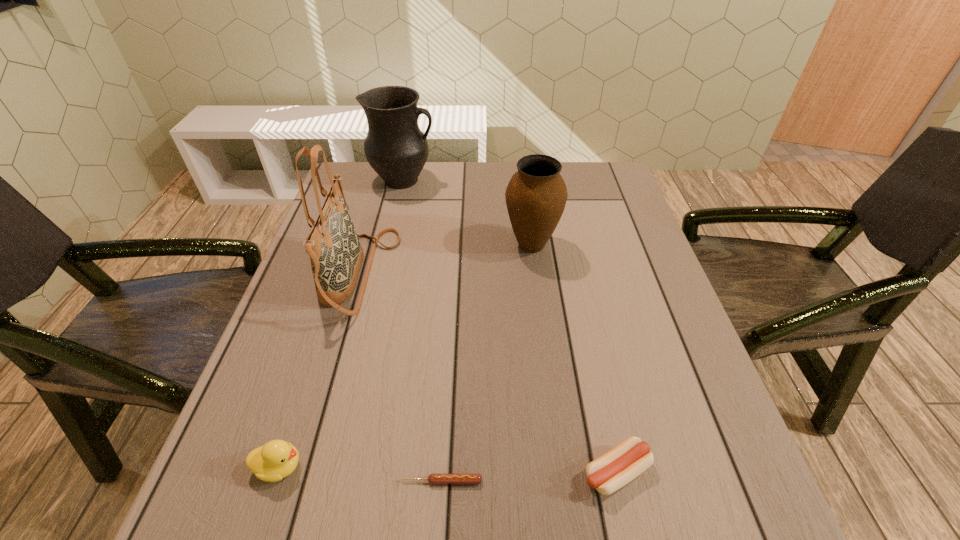
In order to click on free spot located on the left of the urn in this screenshot , I will do `click(461, 245)`.

This screenshot has width=960, height=540. In order to click on free space located on the beak of the duckling in this screenshot , I will do `click(371, 467)`.

The height and width of the screenshot is (540, 960). Identify the location of free region located on the left of the taller sausage. (538, 472).

Locate an element on the screen. This screenshot has height=540, width=960. free location located on the right of the shortest object is located at coordinates (728, 481).

I want to click on object that is at the far edge, so click(x=395, y=147).

The width and height of the screenshot is (960, 540). I want to click on object that is at the near edge, so click(616, 468).

The image size is (960, 540). In order to click on handbag that is at the left edge in this screenshot , I will do `click(336, 255)`.

The width and height of the screenshot is (960, 540). Find the location of `pitcher that is at the left edge`. pitcher that is at the left edge is located at coordinates (395, 147).

What are the coordinates of `duckling at the left edge` in the screenshot? It's located at (277, 459).

This screenshot has width=960, height=540. I want to click on object that is at the right edge, so click(616, 468).